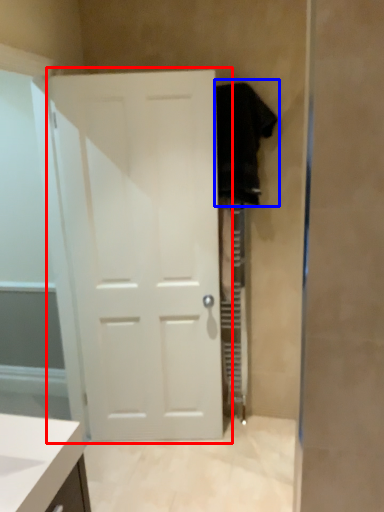
Question: Which object is closer to the camera taking this photo, door (highlighted by a red box) or robe (highlighted by a blue box)?

Choices:
 (A) door
 (B) robe

Answer: (A)